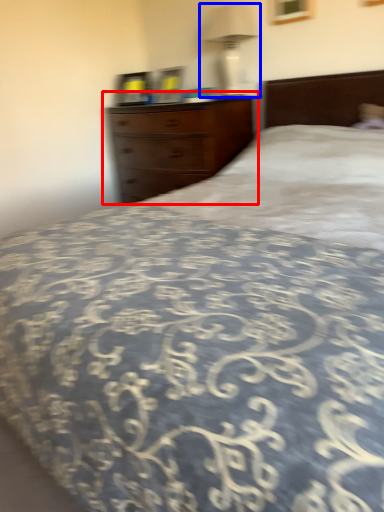
Question: Among these objects, which one is nearest to the camera, chest of drawers (highlighted by a red box) or bedside lamp (highlighted by a blue box)?

Choices:
 (A) chest of drawers
 (B) bedside lamp

Answer: (A)